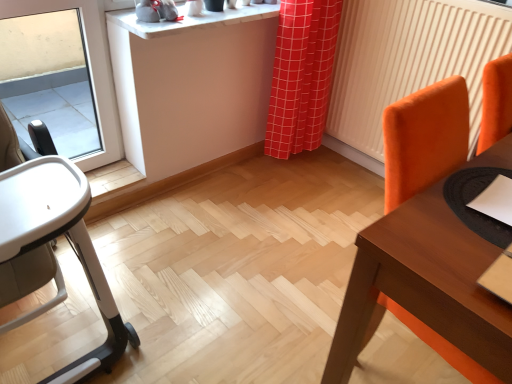
Question: Is the position of orange fabric radiator at right more distant than that of red checkered curtain at center?

Choices:
 (A) yes
 (B) no

Answer: (B)

Question: Could you tell me if orange fabric radiator at right is turned towards red checkered curtain at center?

Choices:
 (A) yes
 (B) no

Answer: (A)

Question: From a real-world perspective, does orange fabric radiator at right stand above red checkered curtain at center?

Choices:
 (A) yes
 (B) no

Answer: (A)

Question: Is orange fabric radiator at right not inside red checkered curtain at center?

Choices:
 (A) yes
 (B) no

Answer: (A)

Question: Is red checkered curtain at center completely or partially inside orange fabric radiator at right?

Choices:
 (A) no
 (B) yes

Answer: (A)

Question: Can you confirm if orange fabric radiator at right is shorter than red checkered curtain at center?

Choices:
 (A) no
 (B) yes

Answer: (A)

Question: From the image's perspective, does beige fabric highchair at left appear lower than red checkered curtain at center?

Choices:
 (A) no
 (B) yes

Answer: (B)

Question: Is beige fabric highchair at left smaller than red checkered curtain at center?

Choices:
 (A) yes
 (B) no

Answer: (B)

Question: Can you confirm if beige fabric highchair at left is thinner than red checkered curtain at center?

Choices:
 (A) yes
 (B) no

Answer: (B)

Question: Does beige fabric highchair at left have a lesser height compared to red checkered curtain at center?

Choices:
 (A) yes
 (B) no

Answer: (B)

Question: Would you say red checkered curtain at center is part of beige fabric highchair at left's contents?

Choices:
 (A) no
 (B) yes

Answer: (A)

Question: Is beige fabric highchair at left looking in the opposite direction of red checkered curtain at center?

Choices:
 (A) yes
 (B) no

Answer: (B)

Question: Does white marble counter top at upper center turn towards wooden table at right?

Choices:
 (A) no
 (B) yes

Answer: (A)